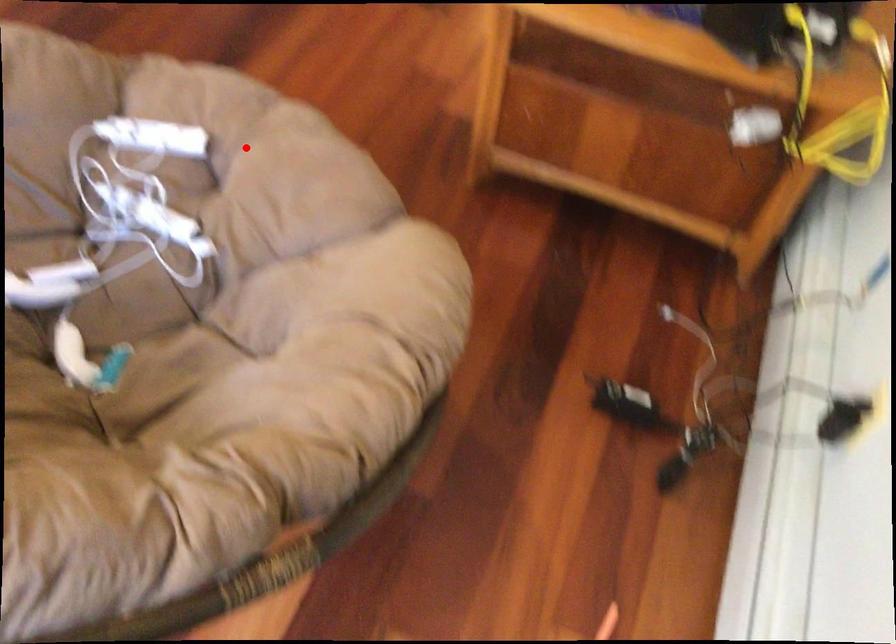
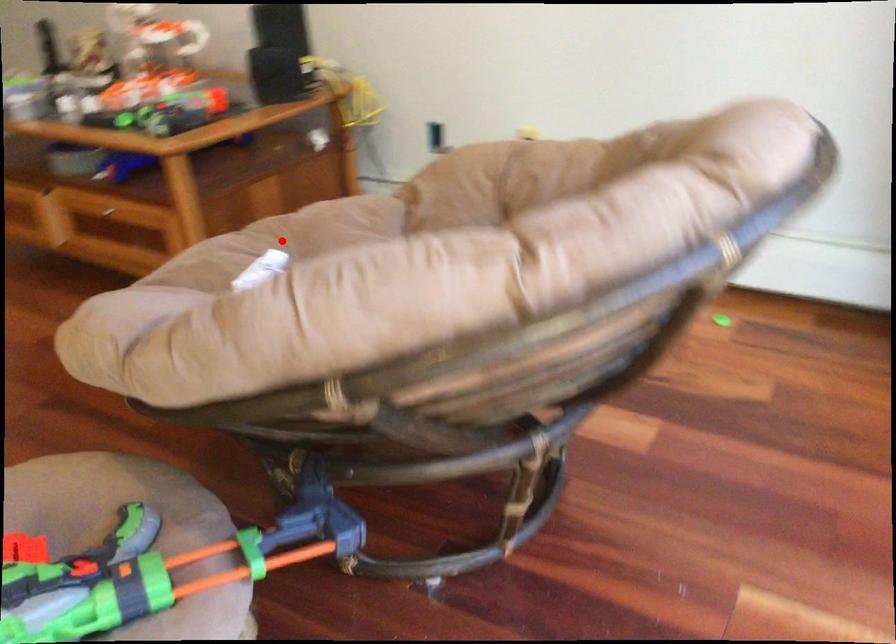
I am providing you with two images of the same scene from different viewpoints. A red point is marked on the first image and another point is marked on the second image. Does the point marked in image1 correspond to the same location as the one in image2?

Yes